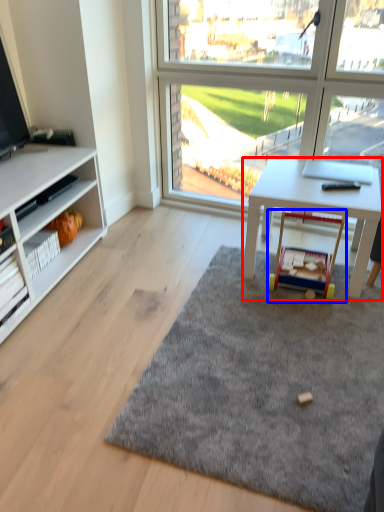
Question: Which point is closer to the camera, desk (highlighted by a red box) or toy (highlighted by a blue box)?

Choices:
 (A) desk
 (B) toy

Answer: (A)